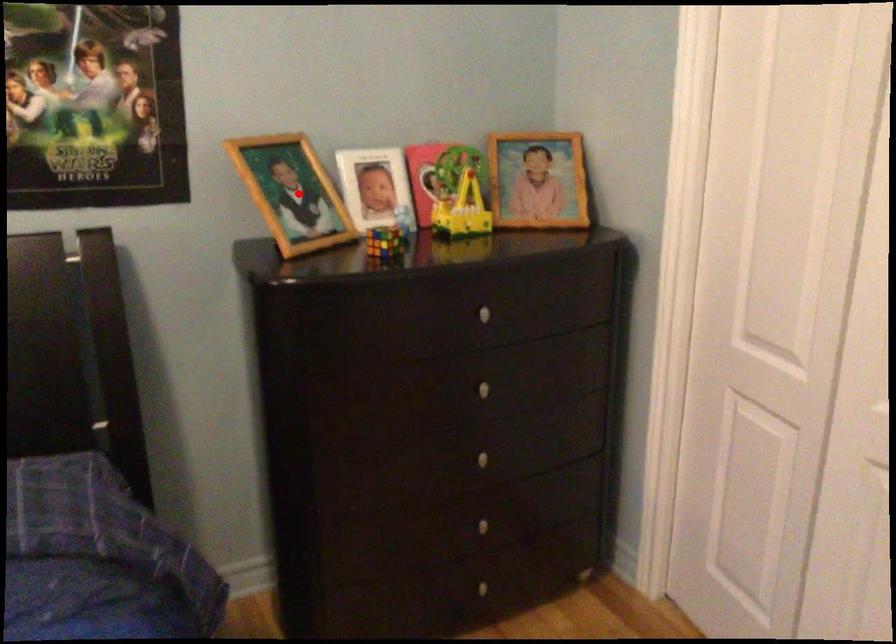
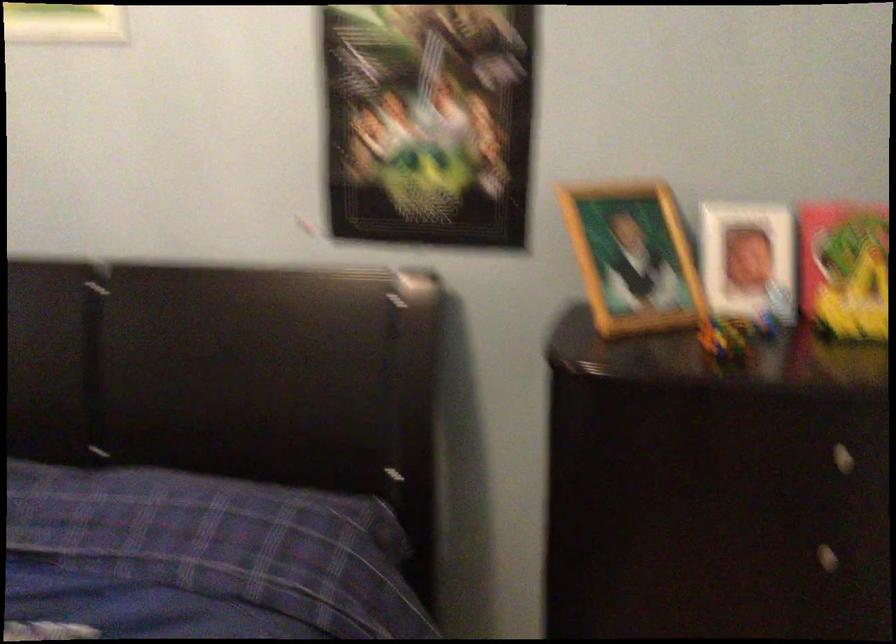
Question: I am providing you with two images of the same scene from different viewpoints. Image1 has a red point marked. In image2, the corresponding 3D location appears at what relative position? Reply with the corresponding letter.

Choices:
 (A) Closer
 (B) Farther

Answer: (A)